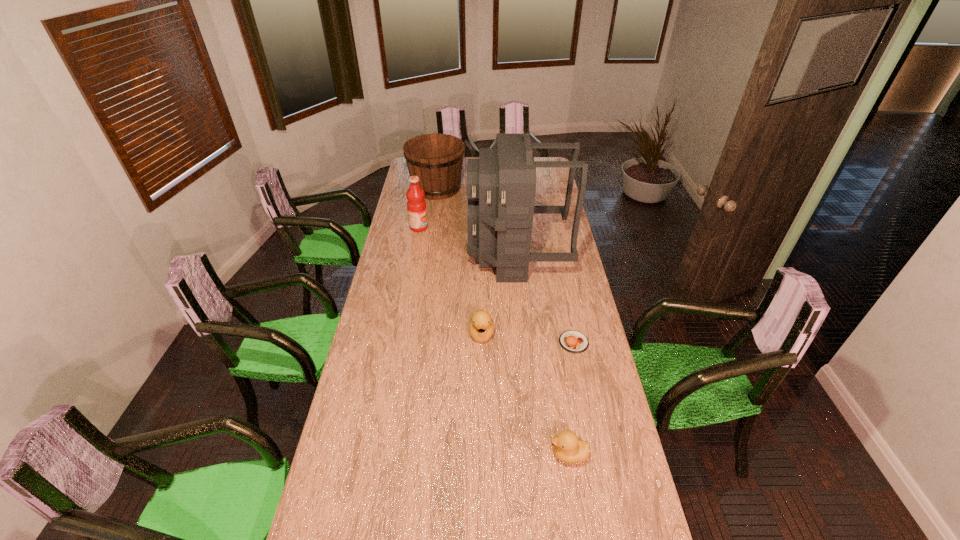
This screenshot has height=540, width=960. Find the location of `vacant space situated 0.220m facing forward on the nearest object`. vacant space situated 0.220m facing forward on the nearest object is located at coordinates (478, 455).

In order to click on free space located facing forward on the nearest object in this screenshot , I will do click(x=437, y=455).

You are a GUI agent. You are given a task and a screenshot of the screen. Output one action in this format:
    pyautogui.click(x=<x>, y=<y>)
    Task: Click on the free space located on the back of the wine bucket
    The height and width of the screenshot is (540, 960).
    Given the screenshot: What is the action you would take?
    pyautogui.click(x=440, y=167)

Where is `free space located on the front compartment of the tallest object`? The height and width of the screenshot is (540, 960). free space located on the front compartment of the tallest object is located at coordinates (432, 255).

You are a GUI agent. You are given a task and a screenshot of the screen. Output one action in this format:
    pyautogui.click(x=<x>, y=<y>)
    Task: Click on the vacant space situated 0.150m on the front compartment of the tallest object
    
    Given the screenshot: What is the action you would take?
    pyautogui.click(x=437, y=255)

Locate an element on the screen. The height and width of the screenshot is (540, 960). free space located 0.330m on the front compartment of the tallest object is located at coordinates (399, 255).

I want to click on vacant area situated on the front label of the fruit juice, so tap(451, 227).

The image size is (960, 540). I want to click on vacant space located 0.200m on the back of the patty (food), so click(x=564, y=297).

Where is `object at the far edge`? The height and width of the screenshot is (540, 960). object at the far edge is located at coordinates (437, 159).

Where is `wine bucket positioned at the left edge`? The height and width of the screenshot is (540, 960). wine bucket positioned at the left edge is located at coordinates (437, 159).